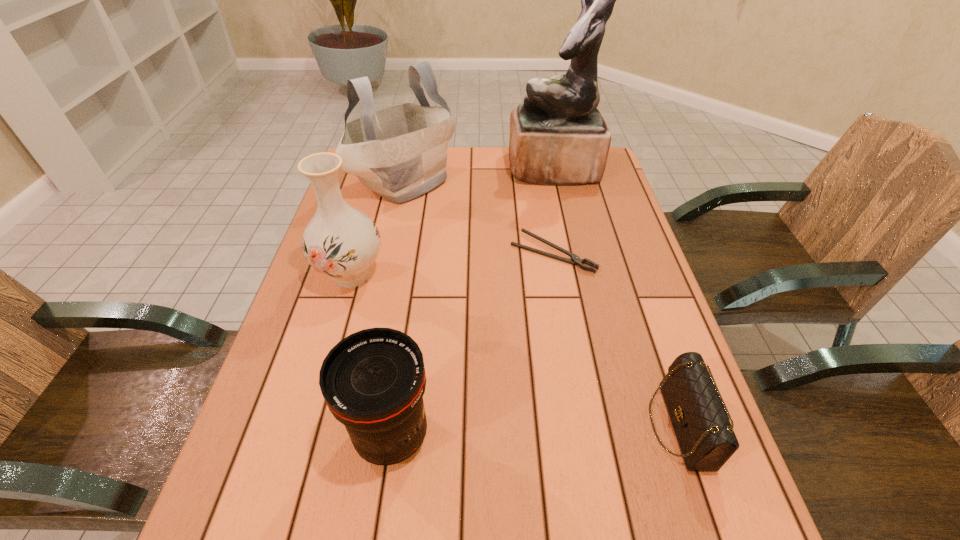
Find the location of a particular element. The height and width of the screenshot is (540, 960). the tallest object is located at coordinates (558, 136).

The width and height of the screenshot is (960, 540). Identify the location of shopping bag. (400, 153).

At what (x,y) coordinates should I click in order to perform the action: click on vase. Please return your answer as a coordinate pair (x, y). The width and height of the screenshot is (960, 540). Looking at the image, I should click on (341, 242).

I want to click on the fourth tallest object, so click(373, 381).

Where is `the second shortest object`? the second shortest object is located at coordinates (699, 416).

Where is `tongs`? tongs is located at coordinates (575, 260).

Find the location of `vacant space located 0.390m in a relaxed pose on the tallest object`. vacant space located 0.390m in a relaxed pose on the tallest object is located at coordinates (391, 168).

This screenshot has height=540, width=960. I want to click on free space located in a relaxed pose on the tallest object, so click(x=418, y=168).

Where is `blank area located 0.350m in a relaxed pose on the tallest object`? The width and height of the screenshot is (960, 540). blank area located 0.350m in a relaxed pose on the tallest object is located at coordinates pos(402,168).

Where is `free spot located on the front of the shopping bag`? free spot located on the front of the shopping bag is located at coordinates (378, 304).